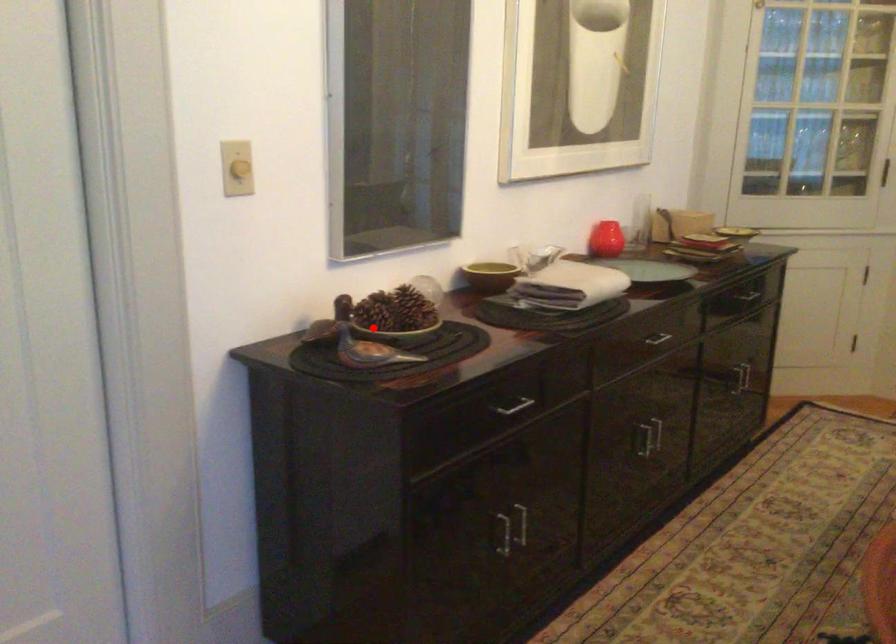
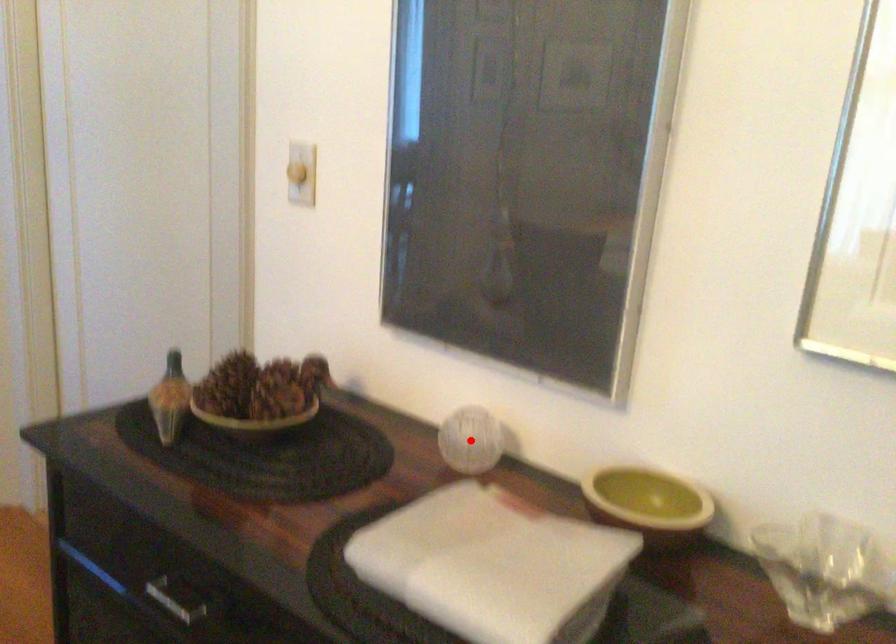
I am providing you with two images of the same scene from different viewpoints. A red point is marked on the first image and another point is marked on the second image. Do the highlighted points in image1 and image2 indicate the same real-world spot?

No